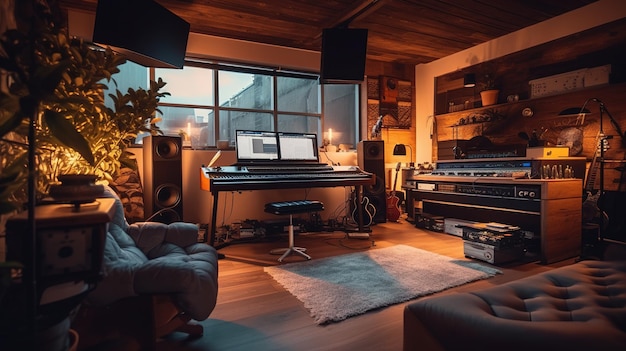
The height and width of the screenshot is (351, 626). Find the location of `rug`. rug is located at coordinates (367, 281).